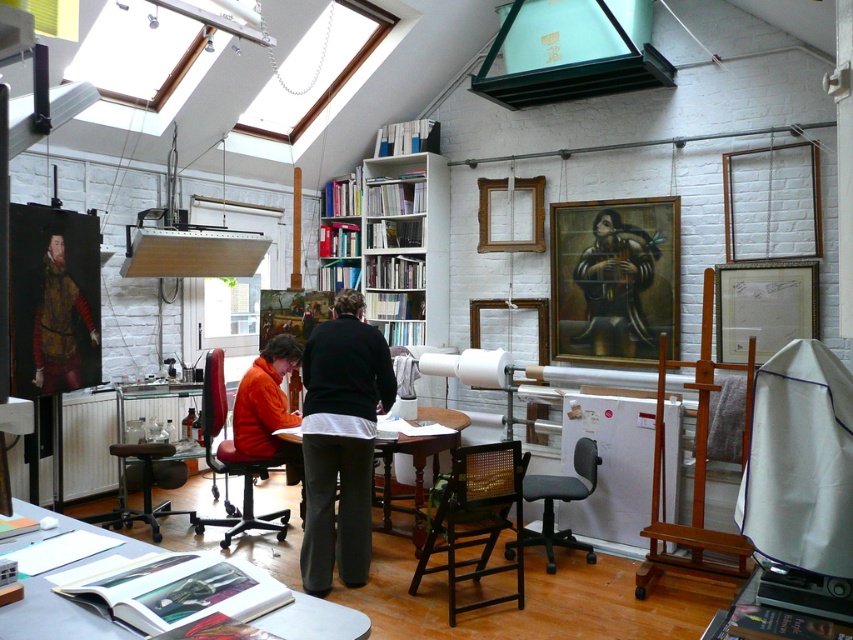
Between wooden table at lower center and wooden chair at center, which one appears on the right side from the viewer's perspective?

From the viewer's perspective, wooden chair at center appears more on the right side.

Between wooden table at lower center and wooden chair at center, which one has more height?

wooden chair at center

Image resolution: width=853 pixels, height=640 pixels. What are the coordinates of `wooden table at lower center` in the screenshot? It's located at pyautogui.click(x=55, y=618).

Does white wooden bookshelf at center appear on the left side of gray fabric chair at center?

Correct, you'll find white wooden bookshelf at center to the left of gray fabric chair at center.

Between point (407, 144) and point (575, 449), which one is positioned behind?

The point (407, 144) is more distant.

Which is behind, point (392, 176) or point (583, 452)?

Positioned behind is point (392, 176).

I want to click on white wooden bookshelf at center, so click(393, 236).

Is wooden table at center positioned at the back of brown leather stool at lower left?

No.

Which is more to the right, wooden table at center or brown leather stool at lower left?

From the viewer's perspective, wooden table at center appears more on the right side.

Between point (416, 486) and point (115, 444), which one is positioned behind?

The point (115, 444) is more distant.

This screenshot has height=640, width=853. I want to click on wooden table at center, so click(416, 468).